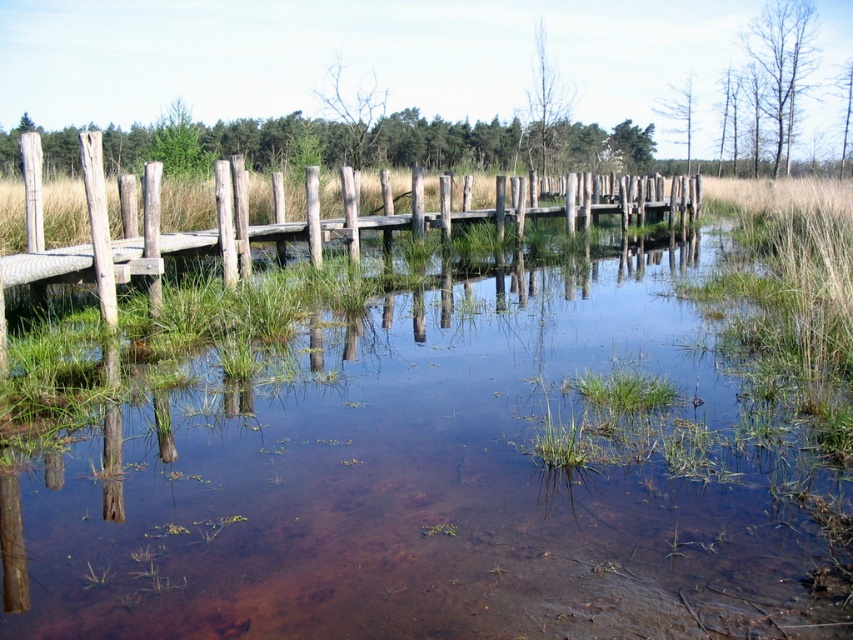
Question: Is clear water at center thinner than wooden planks at center?

Choices:
 (A) no
 (B) yes

Answer: (B)

Question: Which point is closer to the camera taking this photo?

Choices:
 (A) (718, 458)
 (B) (315, 196)

Answer: (A)

Question: Is clear water at center below wooden planks at center?

Choices:
 (A) no
 (B) yes

Answer: (B)

Question: Is clear water at center smaller than wooden planks at center?

Choices:
 (A) no
 (B) yes

Answer: (B)